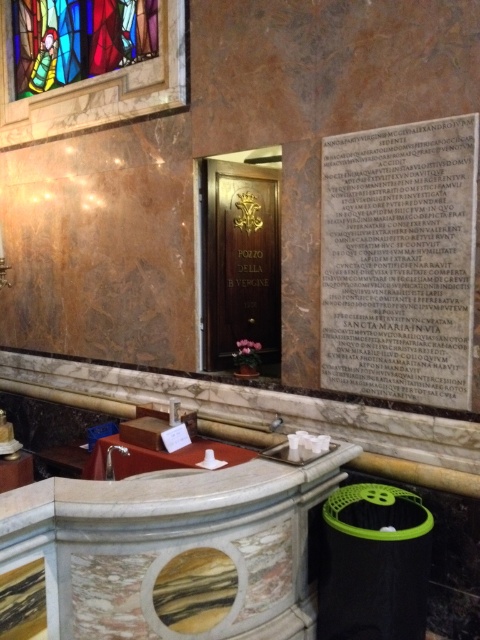
Looking at this image, you are an architect visiting a historic building and need to determine the spatial relationship between the black stone plaque at center and the stained glass window at upper left. Based on the scene, which object is closer to the viewer?

The black stone plaque at center is closer to the viewer because it is in front of the stained glass window at upper left.

You are standing in the church and want to locate the black stone plaque at center. According to the scene description, where exactly is the plaque positioned relative to the wooden door with the brass emblem?

The black stone plaque at center is located to the right of the wooden door with the brass emblem.